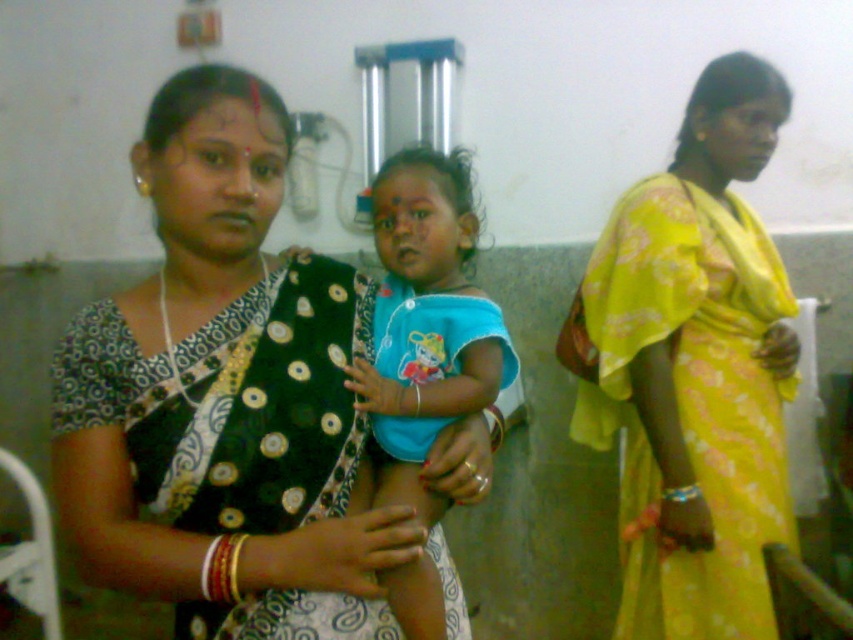
Question: Where is black satin saree at center located in relation to blue cotton dress at center in the image?

Choices:
 (A) right
 (B) left

Answer: (B)

Question: Which of the following is the farthest from the observer?

Choices:
 (A) (651, 637)
 (B) (403, 490)
 (C) (219, 627)

Answer: (A)

Question: Which of these objects is positioned farthest from the blue cotton dress at center?

Choices:
 (A) black satin saree at center
 (B) yellow floral saree at right

Answer: (B)

Question: Which point is farther from the camera taking this photo?

Choices:
 (A) (625, 563)
 (B) (200, 376)
 (C) (378, 326)

Answer: (A)

Question: Can you confirm if black satin saree at center is positioned above blue cotton dress at center?

Choices:
 (A) no
 (B) yes

Answer: (A)

Question: Does black satin saree at center lie behind yellow floral saree at right?

Choices:
 (A) yes
 (B) no

Answer: (B)